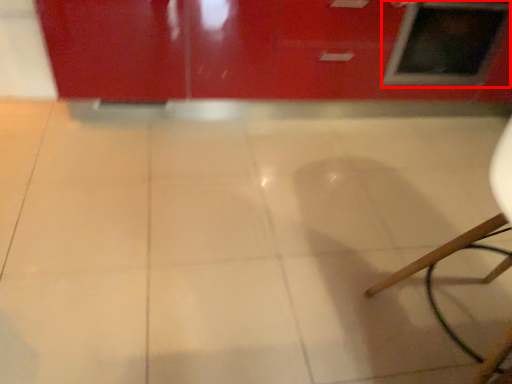
Question: From the image's perspective, what is the correct spatial positioning of window (annotated by the red box) in reference to ceramic tile?

Choices:
 (A) below
 (B) above

Answer: (B)